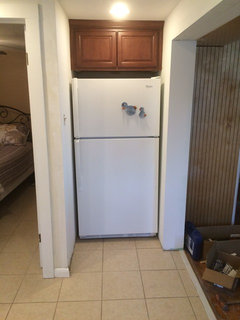
Image resolution: width=240 pixels, height=320 pixels. I want to click on refrigerator magnets, so click(131, 112), click(141, 113).